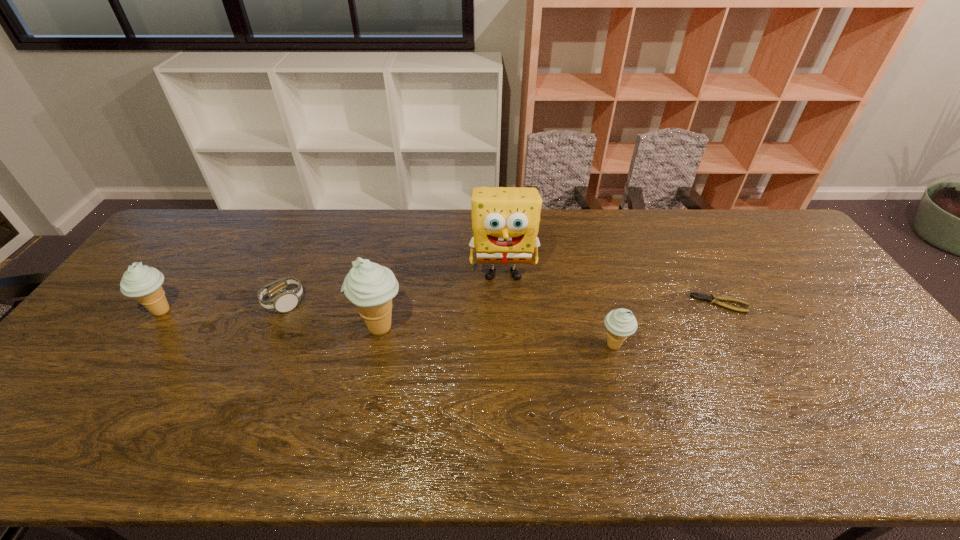
Locate an element on the screen. Image resolution: width=960 pixels, height=540 pixels. the second object from left to right is located at coordinates coord(286,300).

In order to click on vacant area located on the right of the leftmost icecream in this screenshot , I will do `click(240, 311)`.

Locate an element on the screen. The width and height of the screenshot is (960, 540). free region located on the back of the tallest icecream is located at coordinates coord(399,236).

The width and height of the screenshot is (960, 540). In order to click on blank space located 0.150m on the back of the rightmost icecream in this screenshot , I will do `click(600, 295)`.

At what (x,y) coordinates should I click in order to perform the action: click on free region located on the left of the rightmost object. Please return your answer as a coordinate pair (x, y). Looking at the image, I should click on tap(638, 303).

Locate an element on the screen. vacant space located 0.140m on the face of the sponge is located at coordinates (506, 327).

The width and height of the screenshot is (960, 540). In order to click on free space located 0.050m on the face of the second shortest object in this screenshot , I will do `click(321, 302)`.

The width and height of the screenshot is (960, 540). I want to click on object that is positioned at the left edge, so click(x=143, y=283).

Where is `vacant space at the far edge of the desktop`? This screenshot has width=960, height=540. vacant space at the far edge of the desktop is located at coordinates (642, 231).

Locate an element on the screen. The height and width of the screenshot is (540, 960). vacant area at the near edge is located at coordinates (846, 413).